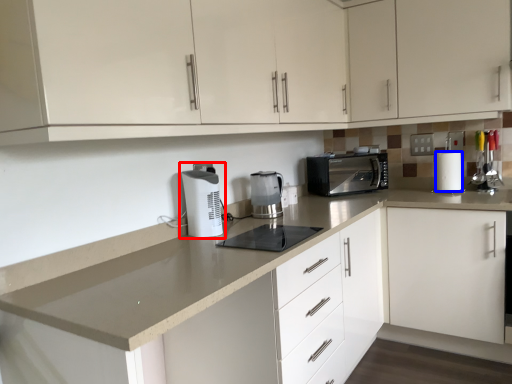
Question: Which of the following is the closest to the observer, home appliance (highlighted by a red box) or paper towel (highlighted by a blue box)?

Choices:
 (A) home appliance
 (B) paper towel

Answer: (A)